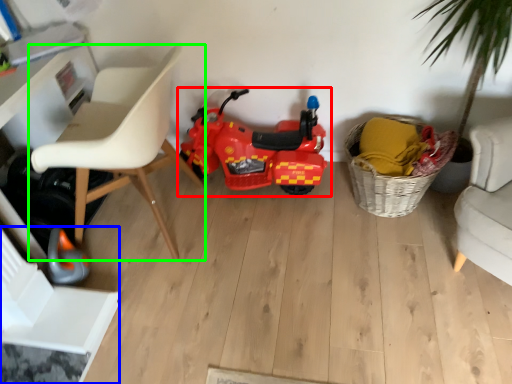
Question: Based on their relative distances, which object is farther from land vehicle (highlighted by a red box)? Choose from swivel chair (highlighted by a blue box) and chair (highlighted by a green box).

Choices:
 (A) swivel chair
 (B) chair

Answer: (A)